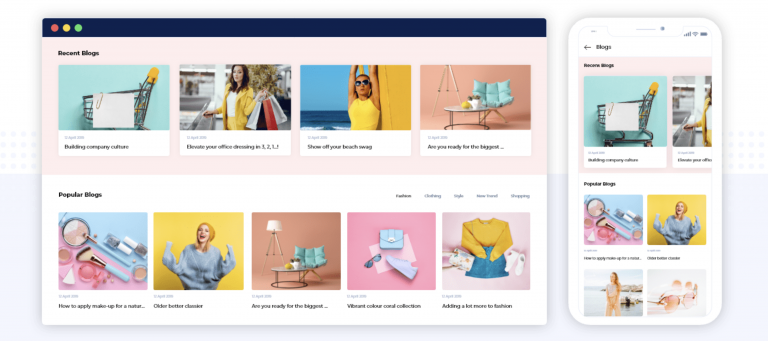
This screenshot has height=341, width=768. I want to click on make up brushes, so click(x=90, y=255), click(x=101, y=245).